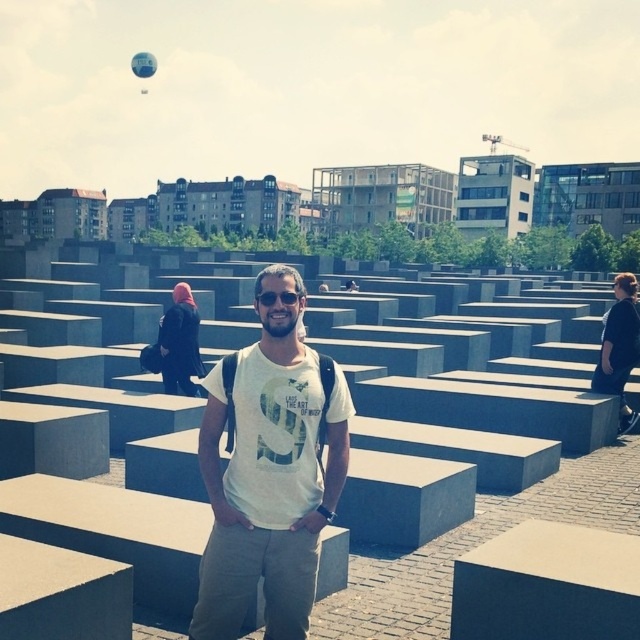
Question: Is the position of black matte shirt at center less distant than that of translucent blue balloon at upper left?

Choices:
 (A) yes
 (B) no

Answer: (A)

Question: Can you confirm if white cotton t-shirt at center is wider than translucent blue balloon at upper left?

Choices:
 (A) yes
 (B) no

Answer: (B)

Question: Does black matte shirt at center appear on the right side of translucent blue balloon at upper left?

Choices:
 (A) no
 (B) yes

Answer: (B)

Question: Which object is farther from the camera taking this photo?

Choices:
 (A) white cotton t-shirt at center
 (B) translucent blue balloon at upper left
 (C) black matte shirt at center

Answer: (B)

Question: Which of the following is the farthest from the observer?

Choices:
 (A) (259, 426)
 (B) (141, 51)
 (C) (600, 376)

Answer: (B)

Question: Which point is closer to the camera?

Choices:
 (A) white cotton t-shirt at center
 (B) black matte shirt at center

Answer: (A)